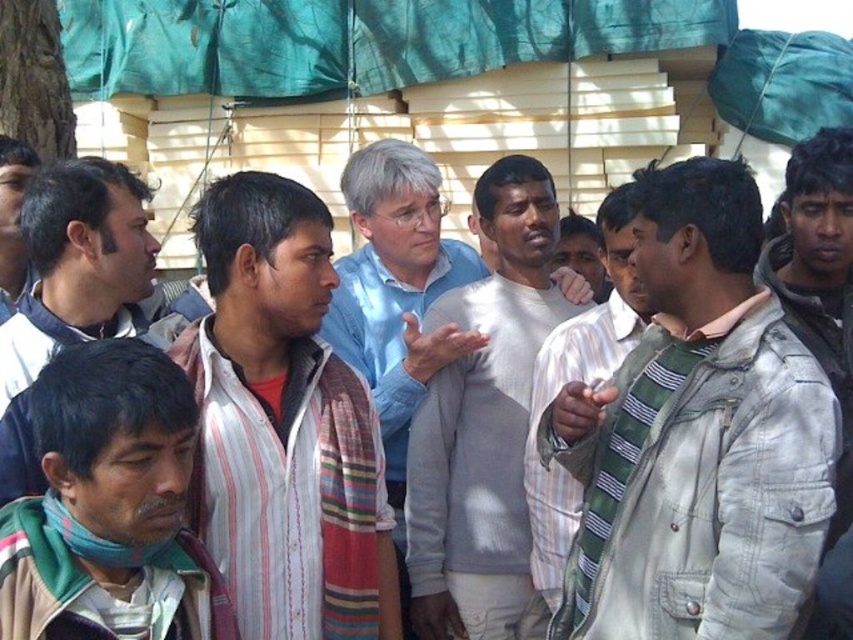
Based on the photo, can you confirm if white striped shirt at center is taller than striped scarf at center?

No, white striped shirt at center is not taller than striped scarf at center.

At what (x,y) coordinates should I click in order to perform the action: click on white striped shirt at center. Please return your answer as a coordinate pair (x, y). Looking at the image, I should click on (283, 426).

Does point (354, 508) come in front of point (608, 236)?

That is True.

Locate an element on the screen. white striped shirt at center is located at coordinates (283, 426).

Between teal fabric canopy at upper center and light gray sweater at center, which one appears on the right side from the viewer's perspective?

From the viewer's perspective, light gray sweater at center appears more on the right side.

In the scene shown: Between teal fabric canopy at upper center and light gray sweater at center, which one is positioned higher?

teal fabric canopy at upper center is above.

Is point (352, 24) farther from viewer compared to point (544, 241)?

Yes, point (352, 24) is behind point (544, 241).

Where is `teal fabric canopy at upper center`? Image resolution: width=853 pixels, height=640 pixels. teal fabric canopy at upper center is located at coordinates (355, 40).

Can you confirm if green striped scarf at lower left is taller than striped scarf at center?

No.

Can you confirm if green striped scarf at lower left is shorter than striped scarf at center?

Indeed, green striped scarf at lower left has a lesser height compared to striped scarf at center.

Is point (90, 420) behind point (532, 525)?

No, (90, 420) is closer to viewer.

Where is `green striped scarf at lower left`? This screenshot has width=853, height=640. green striped scarf at lower left is located at coordinates (109, 506).